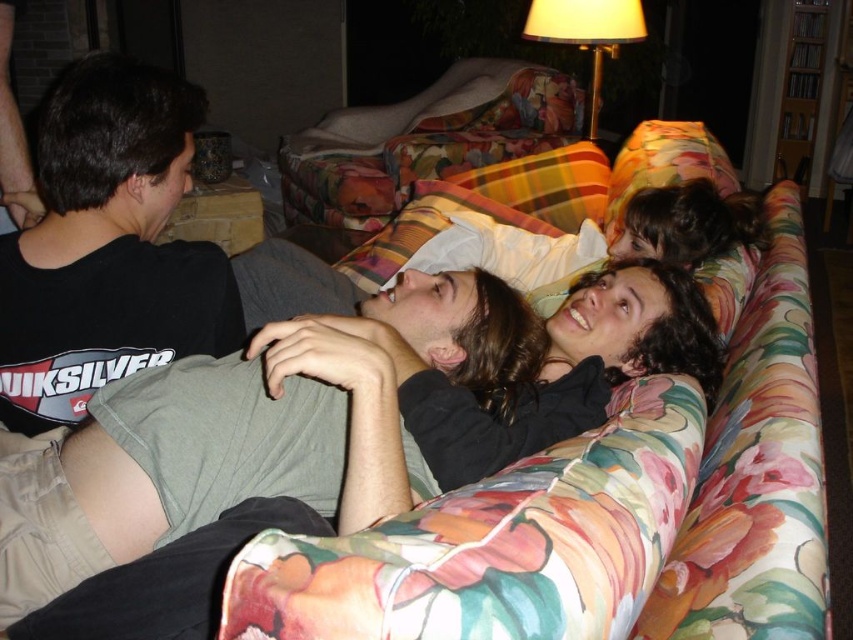
Which is below, gray cotton shirt at center or black soft hair at center?

gray cotton shirt at center

Describe the element at coordinates (202, 460) in the screenshot. I see `gray cotton shirt at center` at that location.

The image size is (853, 640). I want to click on gray cotton shirt at center, so click(x=202, y=460).

Find the location of `gray cotton shirt at center`. gray cotton shirt at center is located at coordinates (202, 460).

Who is taller, floral fabric couch at center or black soft hair at center?

floral fabric couch at center

Find the location of a particular element. This screenshot has height=640, width=853. floral fabric couch at center is located at coordinates (605, 509).

Can you confirm if floral fabric couch at center is shorter than dark gray shirt at center?

In fact, floral fabric couch at center may be taller than dark gray shirt at center.

Does point (769, 333) come in front of point (184, 81)?

Yes, point (769, 333) is closer to viewer.

Does point (766, 630) come behind point (47, 109)?

No.

Image resolution: width=853 pixels, height=640 pixels. Find the location of `floral fabric couch at center`. floral fabric couch at center is located at coordinates (605, 509).